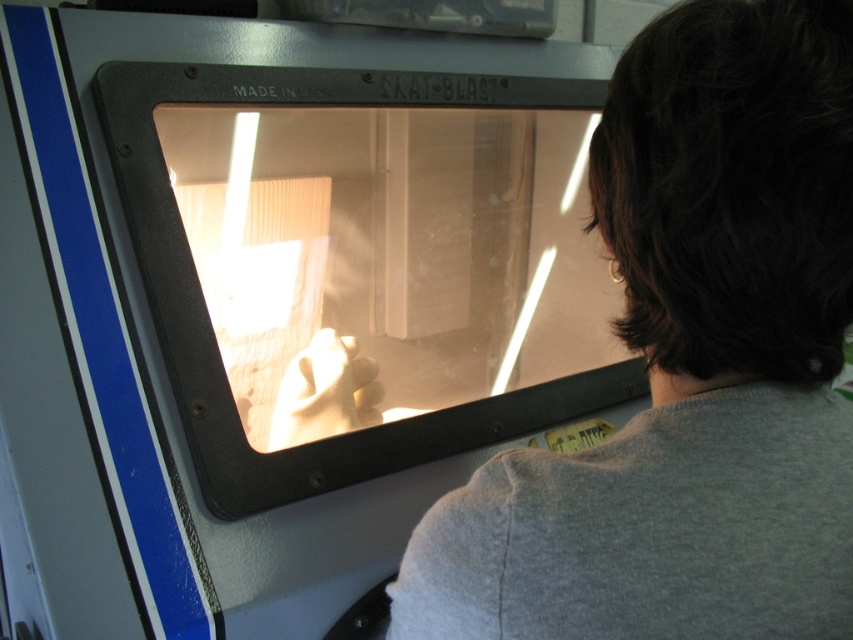
You are a safety inspector in the workshop. You need to ensure that the gray cotton shirt at center does not come into contact with the transparent glass screen at center. Based on their sizes, is this possible?

The gray cotton shirt at center is narrower than the transparent glass screen at center, so there is enough space to prevent contact between them.

You are an inspector in the workshop. You need to check if the gray cotton shirt at center is shorter than the transparent glass screen at center. Based on the scene, can you confirm this?

The gray cotton shirt at center is not as tall as transparent glass screen at center, so yes, the gray cotton shirt at center is shorter than the transparent glass screen at center.

You are a safety inspector in the workshop. You notice the gray cotton shirt at center and the transparent glass screen at center. According to safety protocols, which object should be positioned closer to the operator for optimal protection against flying debris during operation?

The transparent glass screen at center should be positioned closer to the operator than the gray cotton shirt at center to provide better protection against flying debris, but according to the description, the gray cotton shirt at center is closer to the viewer than the transparent glass screen at center, which may not comply with safety standards.